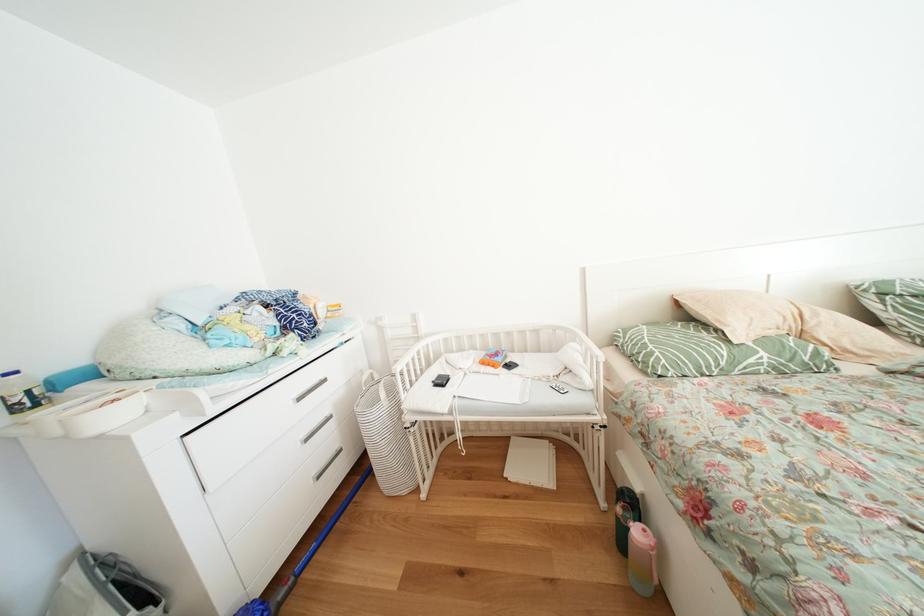
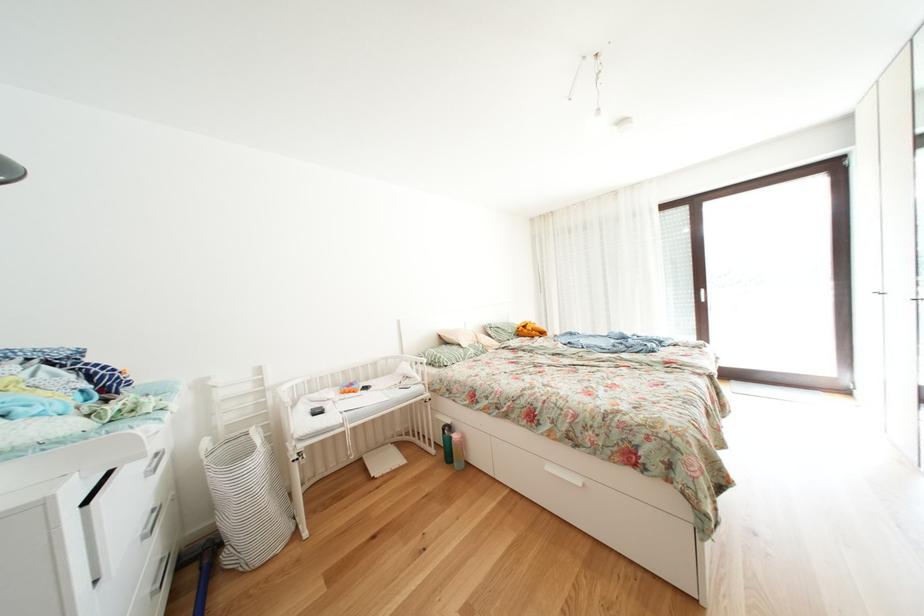
Question: I am providing you with two images of the same scene from different viewpoints. Which of the following objects are not visible in image2?

Choices:
 (A) green water bottle
 (B) black wardrobe handle
 (C) blue vacuum handle
 (D) none of these

Answer: (D)